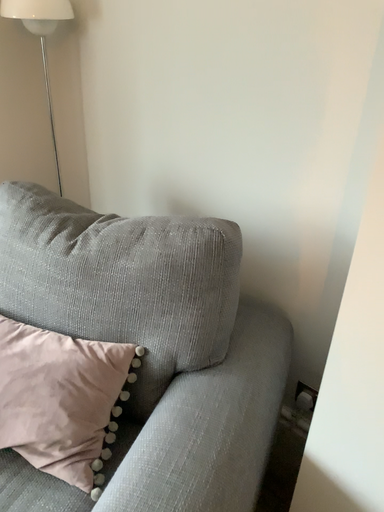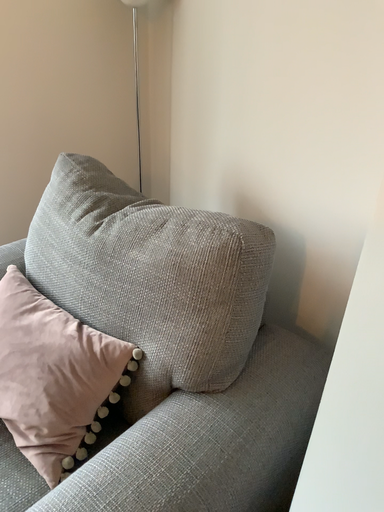
Question: Which way did the camera rotate in the video?

Choices:
 (A) rotated left
 (B) rotated right

Answer: (A)